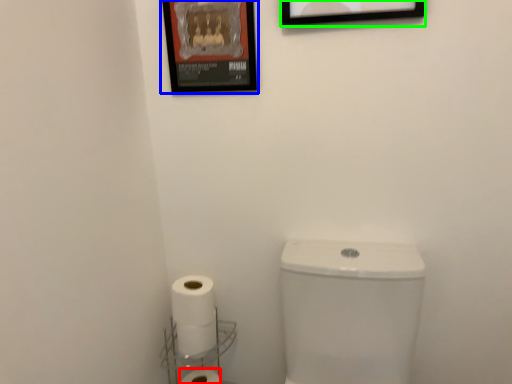
Question: Estimate the real-world distances between objects in this image. Which object is closer to toilet paper (highlighted by a red box), picture frame (highlighted by a blue box) or picture frame (highlighted by a green box)?

Choices:
 (A) picture frame
 (B) picture frame

Answer: (A)